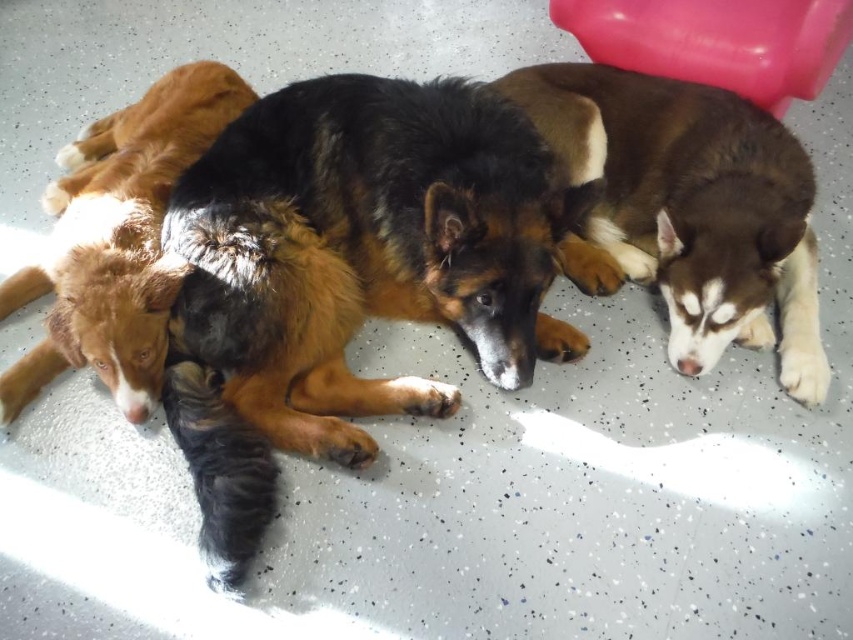
Does black fur dog at center have a lesser height compared to brown fluffy dog at center?

Correct, black fur dog at center is not as tall as brown fluffy dog at center.

Is black fur dog at center closer to camera compared to brown fluffy dog at center?

Yes, black fur dog at center is in front of brown fluffy dog at center.

I want to click on black fur dog at center, so click(x=370, y=248).

Can you confirm if brown fur dog at right is positioned below brown fluffy dog at center?

No.

Is brown fur dog at right taller than brown fluffy dog at center?

Incorrect, brown fur dog at right's height is not larger of brown fluffy dog at center's.

Who is more distant from viewer, (730,234) or (193,132)?

The point (193,132) is behind.

Where is `brown fur dog at right`? This screenshot has height=640, width=853. brown fur dog at right is located at coordinates (692, 208).

From the picture: Measure the distance from black fur dog at center to brown fur dog at right.

34.52 centimeters

Is black fur dog at center smaller than brown fur dog at right?

No.

Find the location of a particular element. This screenshot has height=640, width=853. black fur dog at center is located at coordinates 370,248.